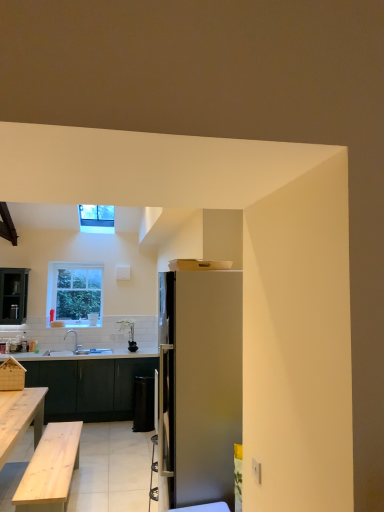
Question: From the image's perspective, would you say white glossy sink at lower left is positioned over clear glass window at upper center, positioned as the 1th window in top-to-bottom order?

Choices:
 (A) yes
 (B) no

Answer: (B)

Question: Is white glossy sink at lower left outside of clear glass window at upper center, positioned as the 1th window in top-to-bottom order?

Choices:
 (A) no
 (B) yes

Answer: (B)

Question: Does white glossy sink at lower left have a lesser width compared to clear glass window at upper center, positioned as the 1th window in front-to-back order?

Choices:
 (A) no
 (B) yes

Answer: (B)

Question: Is white glossy sink at lower left beside clear glass window at upper center, which is the second window in bottom-to-top order?

Choices:
 (A) yes
 (B) no

Answer: (B)

Question: Does white glossy sink at lower left have a greater width compared to clear glass window at upper center, which is the second window in back-to-front order?

Choices:
 (A) yes
 (B) no

Answer: (B)

Question: Considering the relative sizes of white glossy sink at lower left and clear glass window at upper center, positioned as the 1th window in top-to-bottom order, in the image provided, is white glossy sink at lower left bigger than clear glass window at upper center, positioned as the 1th window in top-to-bottom order,?

Choices:
 (A) no
 (B) yes

Answer: (B)

Question: Is clear glass window at upper left, positioned as the second window in top-to-bottom order, at the right side of satin silver refrigerator at center?

Choices:
 (A) yes
 (B) no

Answer: (B)

Question: Can you confirm if clear glass window at upper left, positioned as the 1th window in back-to-front order, is smaller than satin silver refrigerator at center?

Choices:
 (A) yes
 (B) no

Answer: (A)

Question: Is clear glass window at upper left, which appears as the 1th window when ordered from the bottom, shorter than satin silver refrigerator at center?

Choices:
 (A) yes
 (B) no

Answer: (A)

Question: From a real-world perspective, is clear glass window at upper left, positioned as the second window in top-to-bottom order, located higher than satin silver refrigerator at center?

Choices:
 (A) yes
 (B) no

Answer: (A)

Question: Is clear glass window at upper left, placed as the 2th window when sorted from front to back, positioned in front of satin silver refrigerator at center?

Choices:
 (A) no
 (B) yes

Answer: (A)

Question: Is clear glass window at upper left, positioned as the second window in top-to-bottom order, in contact with satin silver refrigerator at center?

Choices:
 (A) no
 (B) yes

Answer: (A)

Question: From the image's perspective, is satin silver refrigerator at center under white glossy coffee cup at center?

Choices:
 (A) no
 (B) yes

Answer: (A)